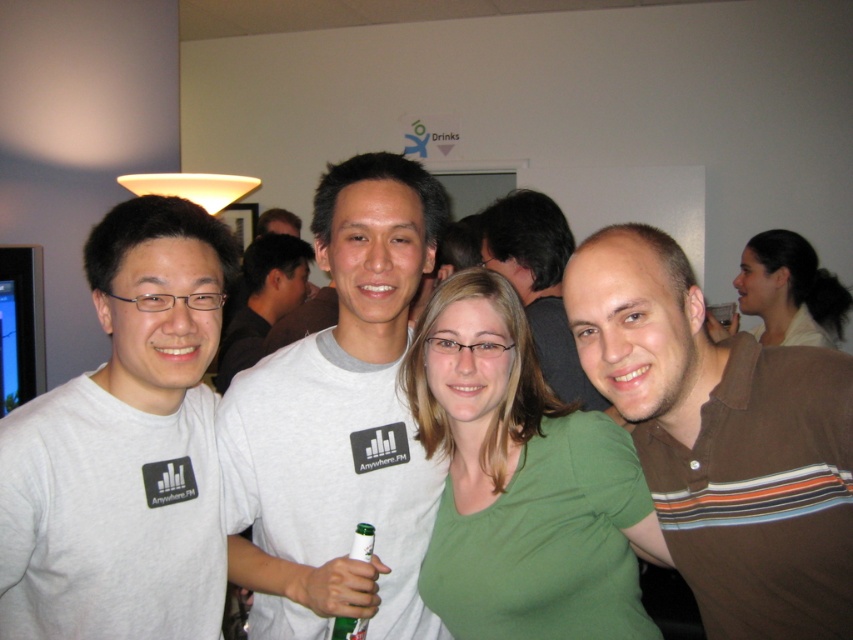
Between white cotton t-shirt at center and green glass bottle at center, which one appears on the right side from the viewer's perspective?

From the viewer's perspective, green glass bottle at center appears more on the right side.

Does white cotton t-shirt at center appear on the left side of green glass bottle at center?

Indeed, white cotton t-shirt at center is positioned on the left side of green glass bottle at center.

This screenshot has width=853, height=640. I want to click on white cotton t-shirt at center, so click(x=339, y=424).

Who is shorter, blonde hair at upper right or white cotton shirt at center?

With less height is blonde hair at upper right.

Is blonde hair at upper right above white cotton shirt at center?

Indeed, blonde hair at upper right is positioned over white cotton shirt at center.

At what (x,y) coordinates should I click in order to perform the action: click on blonde hair at upper right. Please return your answer as a coordinate pair (x, y). Looking at the image, I should click on (790, 291).

Find the location of a particular element. This screenshot has height=640, width=853. blonde hair at upper right is located at coordinates (790, 291).

Which is behind, point (659, 394) or point (364, 545)?

Point (364, 545)

Is brown striped polo shirt at right smaller than green glass bottle at center?

Incorrect, brown striped polo shirt at right is not smaller in size than green glass bottle at center.

Locate an element on the screen. The width and height of the screenshot is (853, 640). brown striped polo shirt at right is located at coordinates (723, 440).